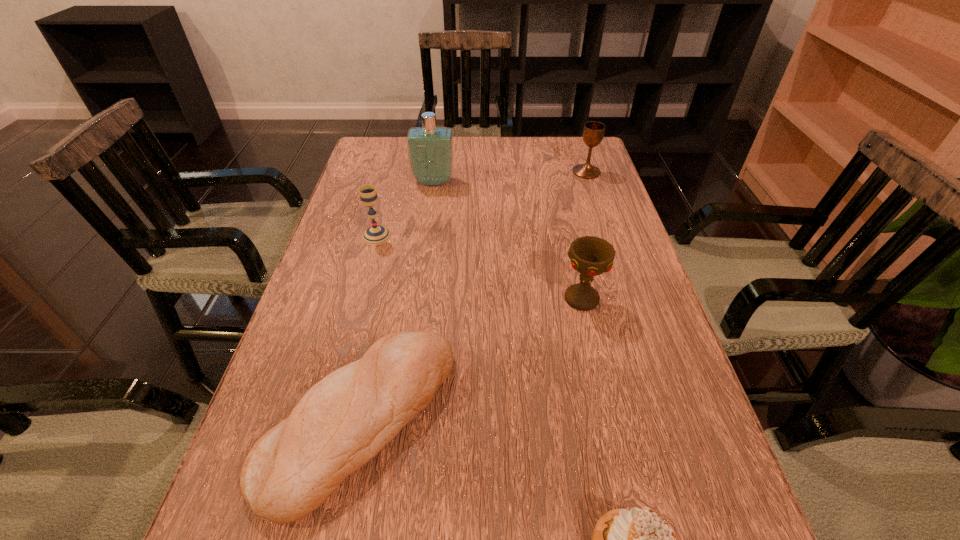
You are a GUI agent. You are given a task and a screenshot of the screen. Output one action in this format:
    pyautogui.click(x=<x>, y=<y>)
    Task: Click on the chalice that can be found as the closest to the tallest object
    
    Given the screenshot: What is the action you would take?
    pyautogui.click(x=376, y=234)

Identify which chalice is the nearest to the second nearest chalice. Please provide its 2D coordinates. Your answer should be formatted as a tuple, i.e. [(x, y)], where the tuple contains the x and y coordinates of a point satisfying the conditions above.

[(591, 256)]

Identify the location of free spot that satisfies the following two spatial constraints: 1. on the back side of the second nearest chalice; 2. on the right side of the rightmost chalice. (394, 172).

Where is `free space that satisfies the following two spatial constraints: 1. on the back side of the third farthest object; 2. on the right side of the rightmost object`? This screenshot has width=960, height=540. free space that satisfies the following two spatial constraints: 1. on the back side of the third farthest object; 2. on the right side of the rightmost object is located at coordinates click(394, 172).

You are a GUI agent. You are given a task and a screenshot of the screen. Output one action in this format:
    pyautogui.click(x=<x>, y=<y>)
    Task: Click on the free space that satisfies the following two spatial constraints: 1. on the back side of the bread; 2. on the right side of the second chalice from left to right
    This screenshot has height=540, width=960.
    Given the screenshot: What is the action you would take?
    pyautogui.click(x=386, y=299)